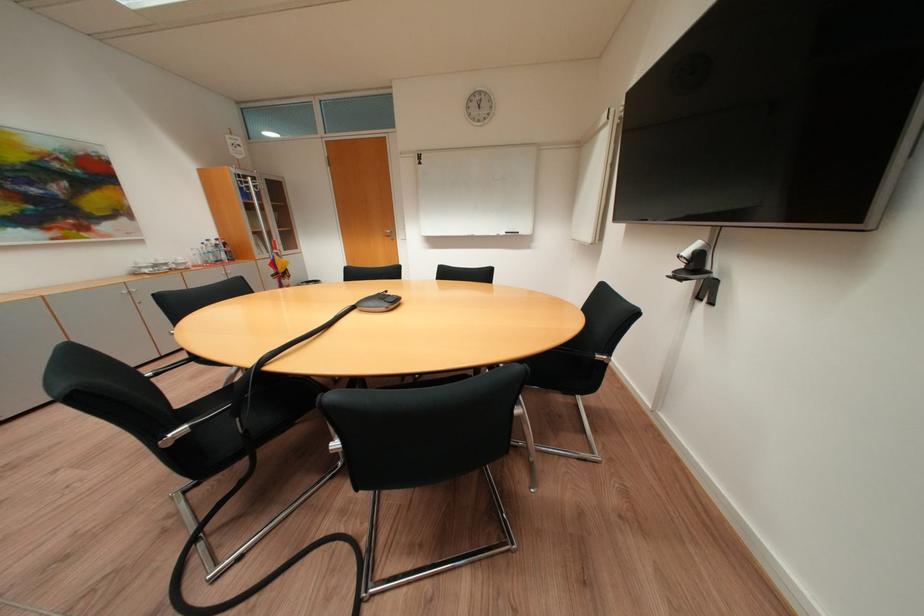
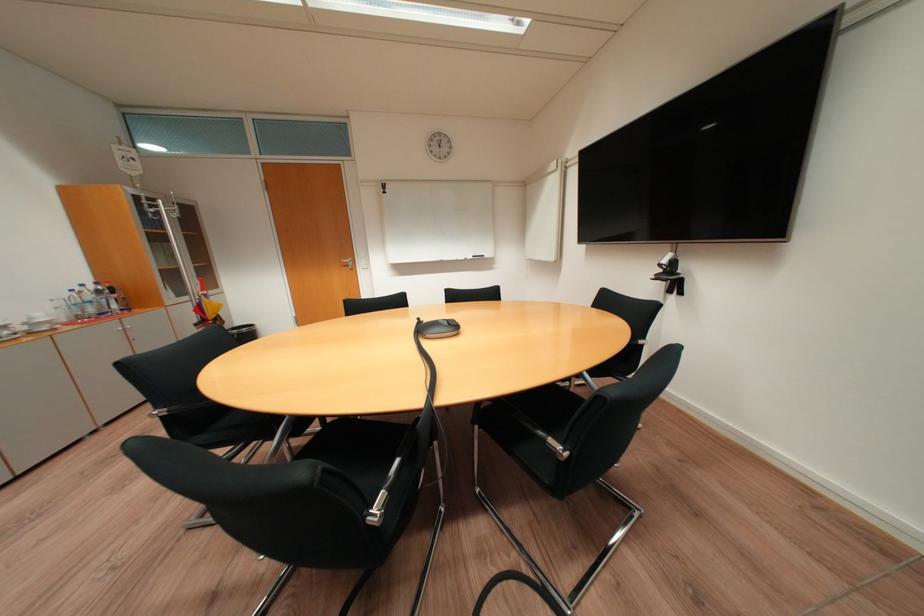
The point at (696, 254) is marked in the first image. Where is the corresponding point in the second image?

(673, 262)